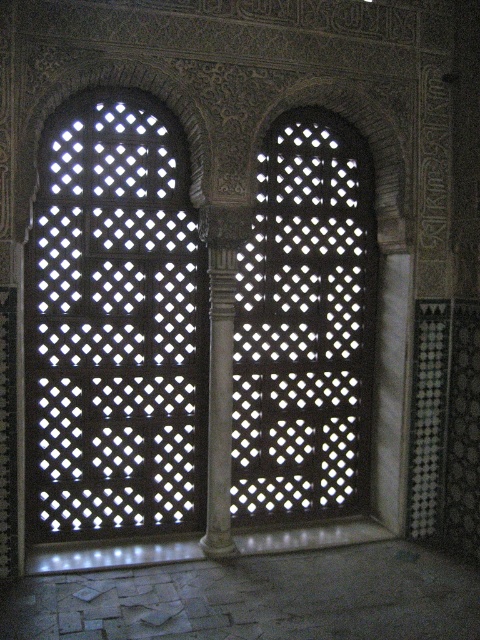
Where is `translucent glass lattice at center`? The image size is (480, 640). translucent glass lattice at center is located at coordinates (304, 324).

Is point (303, 125) in front of point (229, 364)?

No, it is not.

This screenshot has height=640, width=480. What do you see at coordinates (304, 324) in the screenshot?
I see `translucent glass lattice at center` at bounding box center [304, 324].

This screenshot has width=480, height=640. I want to click on translucent glass lattice at center, so click(x=304, y=324).

Is point (119, 128) positioned before point (369, 397)?

That is True.

Based on the photo, how far apart are translucent glass lattice at left and translucent glass lattice at center?

They are 24.38 inches apart.

Find the location of a particular element. The width and height of the screenshot is (480, 640). translucent glass lattice at left is located at coordinates (113, 324).

I want to click on translucent glass lattice at left, so click(113, 324).

Is point (166, 144) farther from camera compared to point (228, 337)?

Yes, point (166, 144) is behind point (228, 337).

Consider the image. Between translucent glass lattice at left and white marble column at center, which one appears on the right side from the viewer's perspective?

white marble column at center

Image resolution: width=480 pixels, height=640 pixels. What do you see at coordinates (113, 324) in the screenshot?
I see `translucent glass lattice at left` at bounding box center [113, 324].

Identify the location of translucent glass lattice at left. (113, 324).